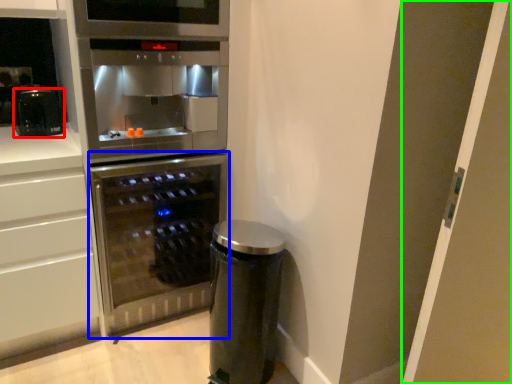
Question: Estimate the real-world distances between objects in this image. Which object is farther from kitchen appliance (highlighted by a red box), home appliance (highlighted by a blue box) or glass door (highlighted by a green box)?

Choices:
 (A) home appliance
 (B) glass door

Answer: (B)